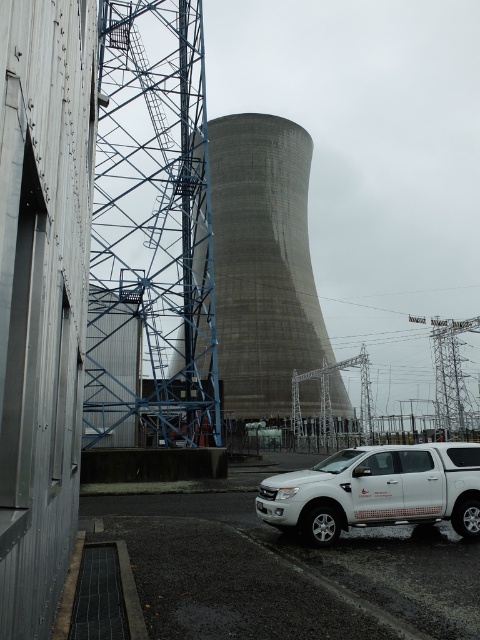
Does blue metallic tower at left have a greater height compared to white matte truck at lower right?

Yes.

Is blue metallic tower at left wider than white matte truck at lower right?

Indeed, blue metallic tower at left has a greater width compared to white matte truck at lower right.

Describe the element at coordinates (151, 230) in the screenshot. I see `blue metallic tower at left` at that location.

You are a GUI agent. You are given a task and a screenshot of the screen. Output one action in this format:
    pyautogui.click(x=<x>, y=<y>)
    Task: Click on the blue metallic tower at left
    The width and height of the screenshot is (480, 640).
    Given the screenshot: What is the action you would take?
    pyautogui.click(x=151, y=230)

Is gray concrete cooling tower at center below white matte truck at lower right?

No.

What do you see at coordinates (263, 262) in the screenshot? The height and width of the screenshot is (640, 480). I see `gray concrete cooling tower at center` at bounding box center [263, 262].

Find the location of a particular element. The height and width of the screenshot is (640, 480). gray concrete cooling tower at center is located at coordinates (263, 262).

Which of these two, blue metallic tower at left or gray concrete cooling tower at center, stands taller?

gray concrete cooling tower at center is taller.

Measure the distance between point (107, 244) and camera.

Point (107, 244) and camera are 113.32 feet apart from each other.

Describe the element at coordinates (151, 230) in the screenshot. The height and width of the screenshot is (640, 480). I see `blue metallic tower at left` at that location.

Where is `blue metallic tower at left`? The height and width of the screenshot is (640, 480). blue metallic tower at left is located at coordinates (151, 230).